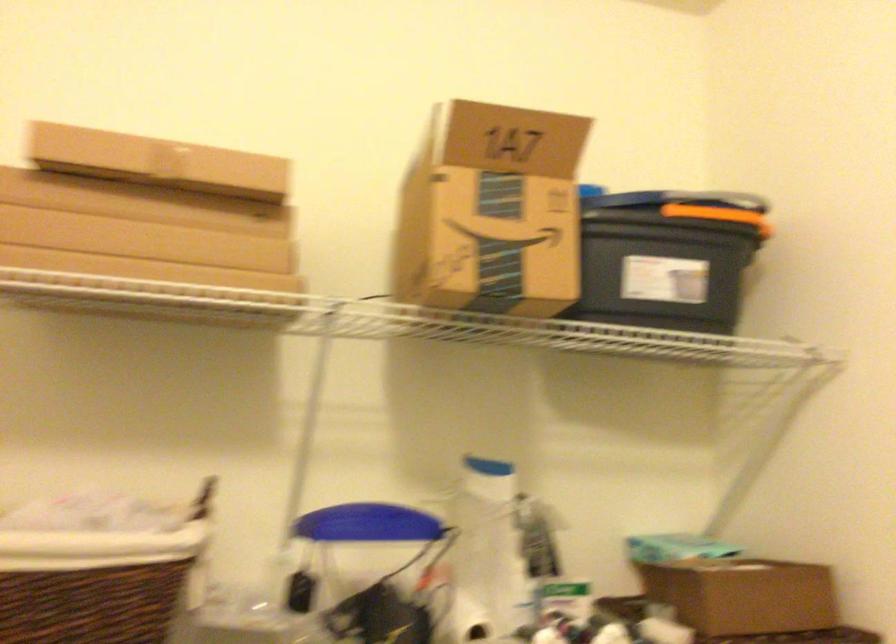
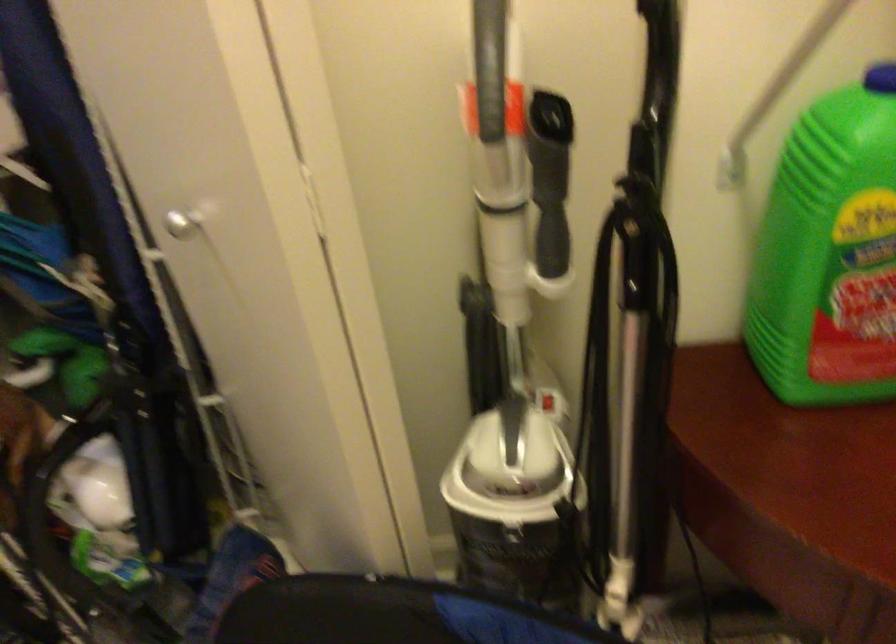
First-person continuous shooting, in which direction is the camera rotating?

The rotation direction of the camera is right-down.